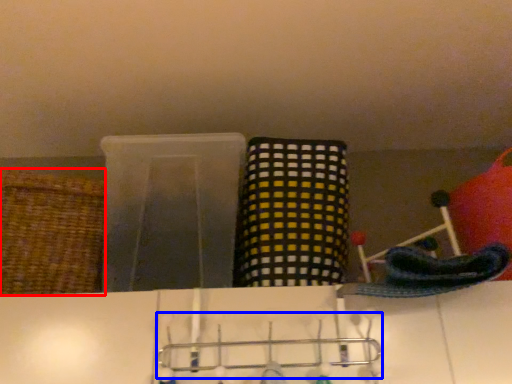
Question: Which point is closer to the camera, basket (highlighted by a red box) or hanger (highlighted by a blue box)?

Choices:
 (A) basket
 (B) hanger

Answer: (B)